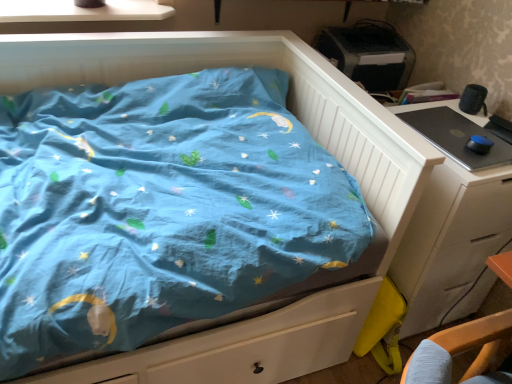
Find the location of `empty space that is ontop of white wood chest of drawers at right (from a real-world perspective)`. empty space that is ontop of white wood chest of drawers at right (from a real-world perspective) is located at coordinates (455, 131).